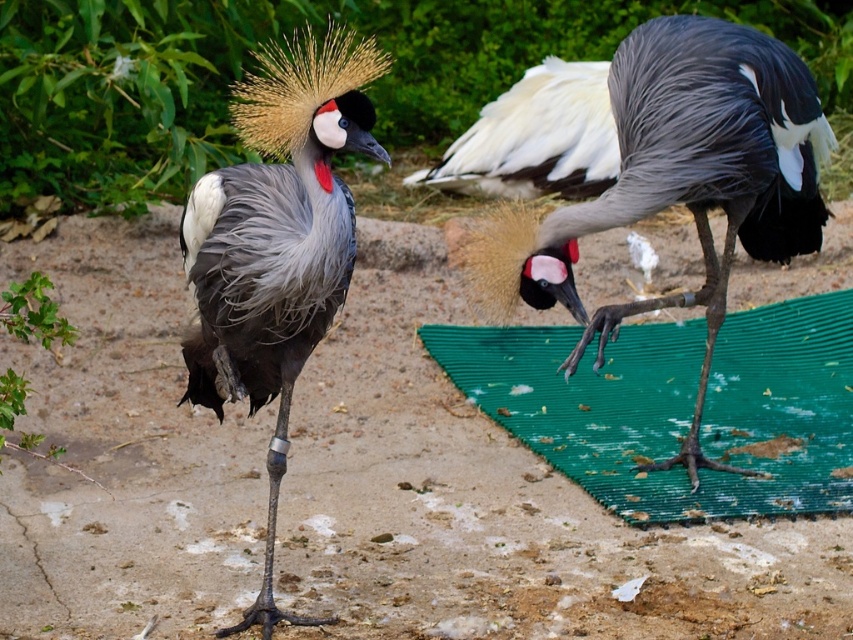
Does green rubber mat at lower right have a smaller size compared to matte gray bird at center?

Actually, green rubber mat at lower right might be larger than matte gray bird at center.

Is point (636, 474) less distant than point (351, 243)?

No, it is behind (351, 243).

Describe the element at coordinates (677, 406) in the screenshot. This screenshot has height=640, width=853. I see `green rubber mat at lower right` at that location.

I want to click on green rubber mat at lower right, so click(677, 406).

Can you confirm if gray matte bird at center is smaller than matte gray bird at center?

No.

Between point (664, 200) and point (276, 486), which one is positioned behind?

Point (664, 200)

Image resolution: width=853 pixels, height=640 pixels. Identify the location of gray matte bird at center. (675, 182).

Identify the location of gray matte bird at center. Image resolution: width=853 pixels, height=640 pixels. (675, 182).

Which is behind, point (685, 426) or point (786, 177)?

Positioned behind is point (685, 426).

Which is in front, point (785, 410) or point (675, 156)?

Positioned in front is point (675, 156).

Identify the location of green rubber mat at lower right. The width and height of the screenshot is (853, 640). (677, 406).

Image resolution: width=853 pixels, height=640 pixels. I want to click on green rubber mat at lower right, so click(677, 406).